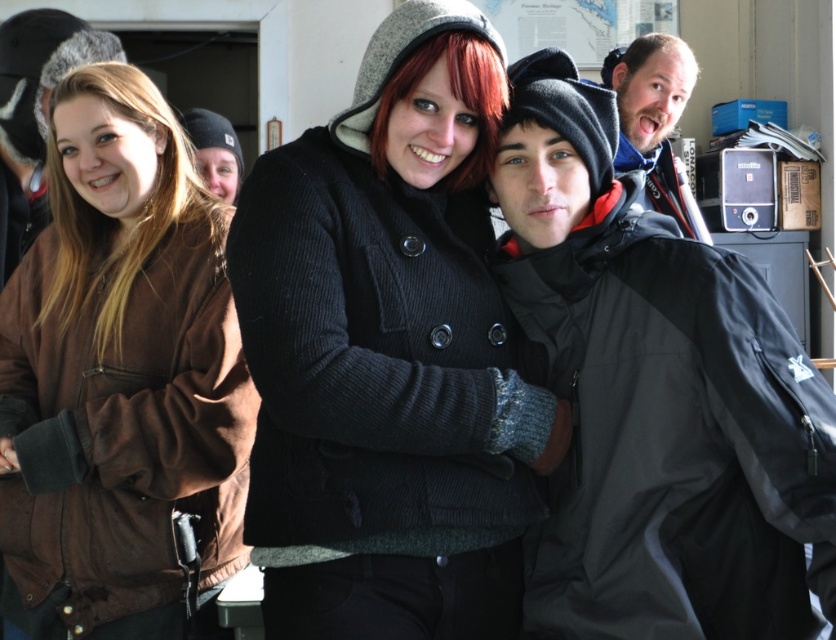
Question: Can you confirm if matte black coat at center is positioned to the left of matte black jacket at center?

Choices:
 (A) no
 (B) yes

Answer: (B)

Question: Which point is farther from the camera taking this photo?

Choices:
 (A) (585, 214)
 (B) (697, 211)
 (C) (470, 232)

Answer: (B)

Question: Which object appears farthest from the camera in this image?

Choices:
 (A) matte black coat at center
 (B) matte black jacket at center
 (C) brown suede jacket at left
 (D) bearded man at upper right

Answer: (D)

Question: Which object is positioned farthest from the matte black coat at center?

Choices:
 (A) matte black jacket at center
 (B) brown suede jacket at left
 (C) bearded man at upper right

Answer: (C)

Question: Is matte black jacket at center to the left of bearded man at upper right from the viewer's perspective?

Choices:
 (A) no
 (B) yes

Answer: (B)

Question: Can you confirm if matte black jacket at center is positioned above brown suede jacket at left?

Choices:
 (A) yes
 (B) no

Answer: (A)